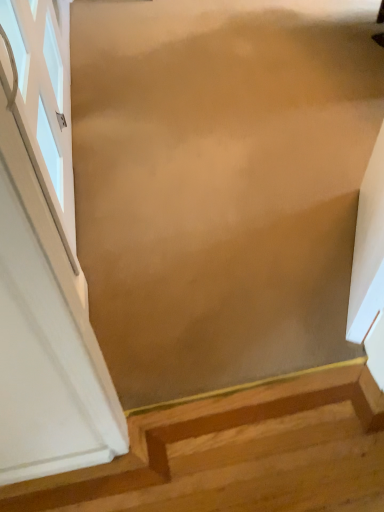
What do you see at coordinates (236, 452) in the screenshot? The width and height of the screenshot is (384, 512). I see `wooden stairs at lower right` at bounding box center [236, 452].

The image size is (384, 512). In order to click on wooden stairs at lower right in this screenshot , I will do `click(236, 452)`.

Describe the element at coordinates (45, 102) in the screenshot. This screenshot has width=384, height=512. I see `white glass window at left` at that location.

Image resolution: width=384 pixels, height=512 pixels. Identify the location of white glass window at left. (45, 102).

Find the location of `wooden stairs at lower right`. wooden stairs at lower right is located at coordinates (236, 452).

Is white glass window at left to the left or to the right of wooden stairs at lower right in the image?

Based on their positions, white glass window at left is located to the left of wooden stairs at lower right.

Between white glass window at left and wooden stairs at lower right, which one is positioned behind?

white glass window at left is further away from the camera.

Does point (31, 28) lie in front of point (379, 416)?

No, it is behind (379, 416).

From the image's perspective, is white glass window at left beneath wooden stairs at lower right?

Incorrect, from the image's perspective, white glass window at left is higher than wooden stairs at lower right.

From a real-world perspective, who is located higher, white glass window at left or wooden stairs at lower right?

white glass window at left is physically above.

Does white glass window at left have a lesser width compared to wooden stairs at lower right?

Correct, the width of white glass window at left is less than that of wooden stairs at lower right.

Is white glass window at left taller than wooden stairs at lower right?

Indeed, white glass window at left has a greater height compared to wooden stairs at lower right.

Which of these two, white glass window at left or wooden stairs at lower right, is bigger?

Bigger between the two is wooden stairs at lower right.

Does white glass window at left contain wooden stairs at lower right?

Definitely not — wooden stairs at lower right is not inside white glass window at left.

From the picture: Are white glass window at left and wooden stairs at lower right located far from each other?

Yes, white glass window at left is far from wooden stairs at lower right.

Consider the image. Is white glass window at left facing towards wooden stairs at lower right?

No, white glass window at left does not turn towards wooden stairs at lower right.

How different are the orientations of white glass window at left and wooden stairs at lower right in degrees?

white glass window at left and wooden stairs at lower right are facing 91.7 degrees away from each other.

Measure the distance from white glass window at left to wooden stairs at lower right.

white glass window at left is 3.60 feet away from wooden stairs at lower right.

In the image, there is a wooden stairs at lower right. Find the location of `window above it (from the image's perspective)`. window above it (from the image's perspective) is located at coordinates (45, 102).

Considering the positions of objects wooden stairs at lower right and white glass window at left in the image provided, who is more to the right, wooden stairs at lower right or white glass window at left?

wooden stairs at lower right.

Considering their positions, is wooden stairs at lower right located in front of or behind white glass window at left?

Visually, wooden stairs at lower right is located in front of white glass window at left.

Which point is more forward, (x=35, y=502) or (x=65, y=120)?

The point (x=35, y=502) is closer.

From the image's perspective, is wooden stairs at lower right above or below white glass window at left?

wooden stairs at lower right is situated lower than white glass window at left in the image.

From a real-world perspective, between wooden stairs at lower right and white glass window at left, who is vertically higher?

white glass window at left.

Is wooden stairs at lower right wider or thinner than white glass window at left?

In the image, wooden stairs at lower right appears to be wider than white glass window at left.

Is wooden stairs at lower right taller or shorter than white glass window at left?

In the image, wooden stairs at lower right appears to be shorter than white glass window at left.

Considering the sizes of wooden stairs at lower right and white glass window at left in the image, is wooden stairs at lower right bigger or smaller than white glass window at left?

In the image, wooden stairs at lower right appears to be larger than white glass window at left.

Can white glass window at left be found inside wooden stairs at lower right?

No, white glass window at left is not inside wooden stairs at lower right.

Is wooden stairs at lower right far from white glass window at left?

Yes, wooden stairs at lower right is far from white glass window at left.

Is wooden stairs at lower right positioned with its back to white glass window at left?

No.

Can you tell me how much wooden stairs at lower right and white glass window at left differ in facing direction?

wooden stairs at lower right and white glass window at left are facing 91.7 degrees away from each other.

Where is `stairs located underneath the white glass window at left (from a real-world perspective)`? stairs located underneath the white glass window at left (from a real-world perspective) is located at coordinates pos(236,452).

This screenshot has width=384, height=512. In order to click on window above the wooden stairs at lower right (from the image's perspective) in this screenshot , I will do pyautogui.click(x=45, y=102).

Image resolution: width=384 pixels, height=512 pixels. I want to click on stairs that is on the right side of white glass window at left, so click(x=236, y=452).